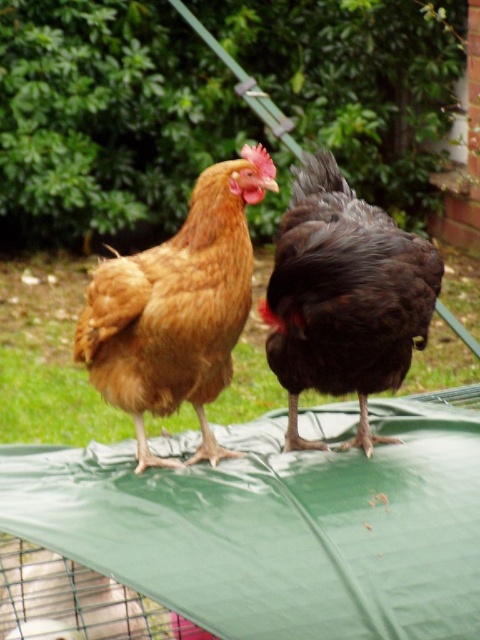
You are a farmer checking your chickens. You notice the golden brown feathered chicken at center and the dark brown glossy chicken at right. Which chicken is located above the other?

The golden brown feathered chicken at center is positioned under the dark brown glossy chicken at right, so the dark brown glossy chicken at right is above the golden brown feathered chicken at center.

You are a farmer checking the chickens in your coop. You notice the golden brown feathered chicken at center and the dark brown glossy chicken at right. Which chicken is wider?

The golden brown feathered chicken at center is wider than the dark brown glossy chicken at right.

You are a farmer looking at the image of your chicken coop. There is a golden brown feathered chicken at center. Where is it located in terms of coordinates?

The golden brown feathered chicken at center is located at coordinates point (178,307).